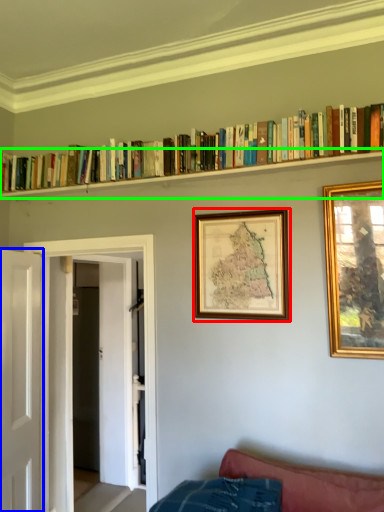
Question: Based on their relative distances, which object is nearer to picture frame (highlighted by a red box)? Choose from door (highlighted by a blue box) and shelf (highlighted by a green box).

Choices:
 (A) door
 (B) shelf

Answer: (B)